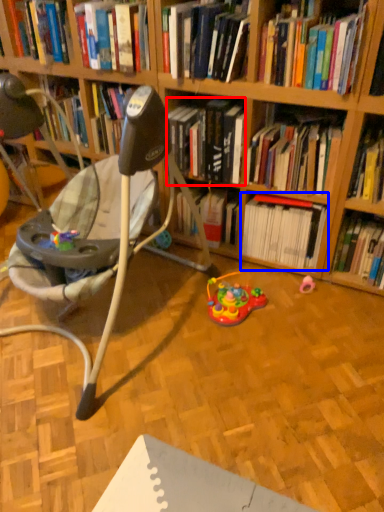
Question: Which object is further to the camera taking this photo, book (highlighted by a red box) or book (highlighted by a blue box)?

Choices:
 (A) book
 (B) book

Answer: (B)